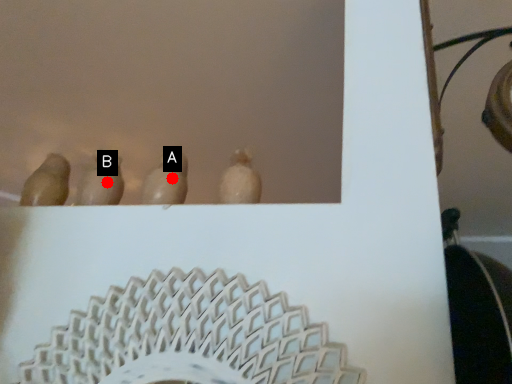
Question: Two points are circled on the image, labeled by A and B beside each circle. Which point is farther from the camera taking this photo?

Choices:
 (A) A is further
 (B) B is further

Answer: (B)